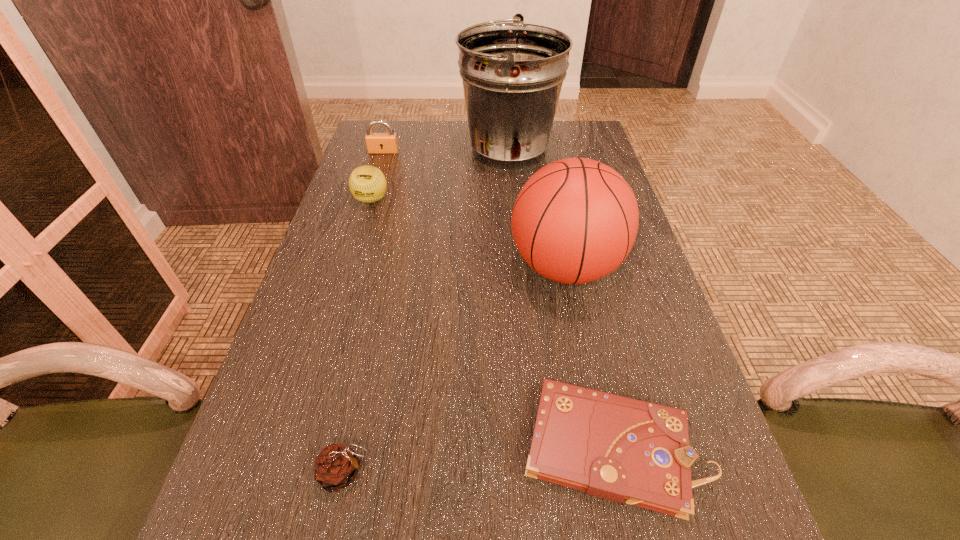
At what (x,y) coordinates should I click in order to perform the action: click on notebook located in the right edge section of the desktop. Please return your answer as a coordinate pair (x, y). The height and width of the screenshot is (540, 960). Looking at the image, I should click on (617, 448).

Where is `object that is at the far left corner`? object that is at the far left corner is located at coordinates (377, 143).

Locate an element on the screen. object present at the far right corner is located at coordinates (512, 73).

The image size is (960, 540). In the image, there is a desktop. What are the coordinates of `free space at the far edge` in the screenshot? It's located at (463, 137).

In the image, there is a desktop. At what (x,y) coordinates should I click in order to perform the action: click on vacant space at the left edge. Please return your answer as a coordinate pair (x, y). Looking at the image, I should click on (362, 239).

The image size is (960, 540). In order to click on free location at the right edge in this screenshot , I will do `click(634, 345)`.

Find the location of a particular element. This screenshot has height=540, width=960. free space at the far left corner of the desktop is located at coordinates (409, 129).

At what (x,y) coordinates should I click in order to perform the action: click on vacant area at the far right corner. Please return your answer as a coordinate pair (x, y). Looking at the image, I should click on [569, 152].

This screenshot has width=960, height=540. I want to click on unoccupied position between the pinecone and the fourth nearest object, so click(x=358, y=336).

The image size is (960, 540). What are the coordinates of `free space between the notebook and the third farthest object` in the screenshot? It's located at (492, 323).